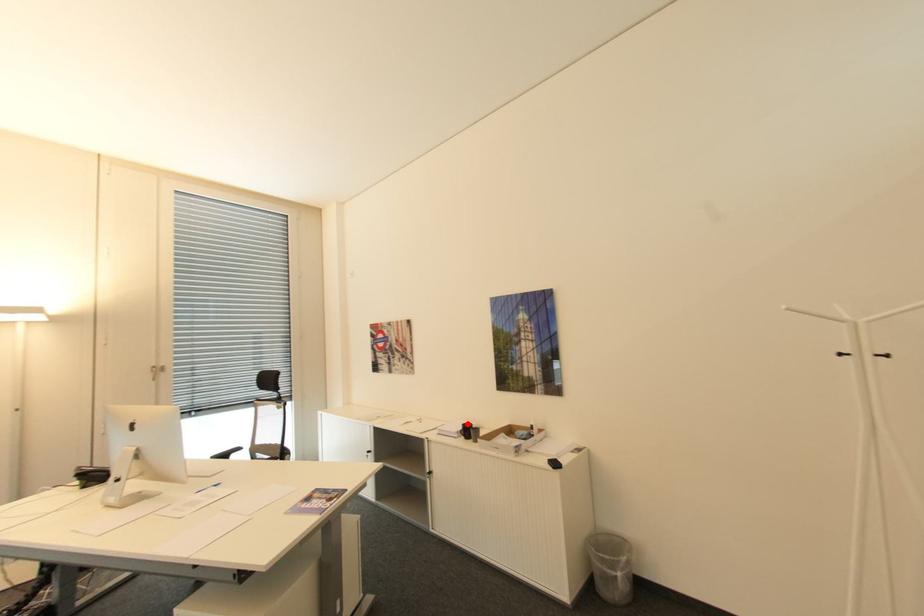
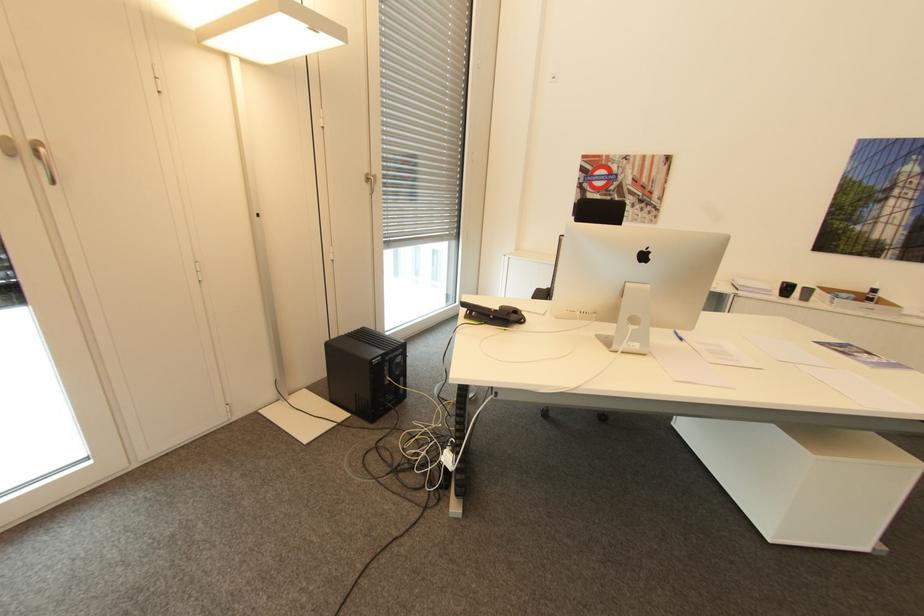
Where in the second image is the point corresponding to the highlighted location from the first image?

(788, 283)